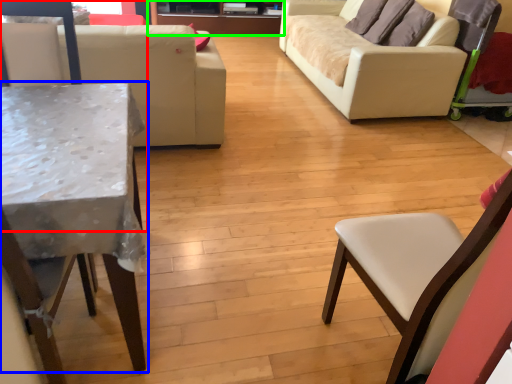
Question: Estimate the real-world distances between objects in this image. Which object is farther from chair (highlighted by a red box), table (highlighted by a blue box) or entertainment center (highlighted by a green box)?

Choices:
 (A) table
 (B) entertainment center

Answer: (B)